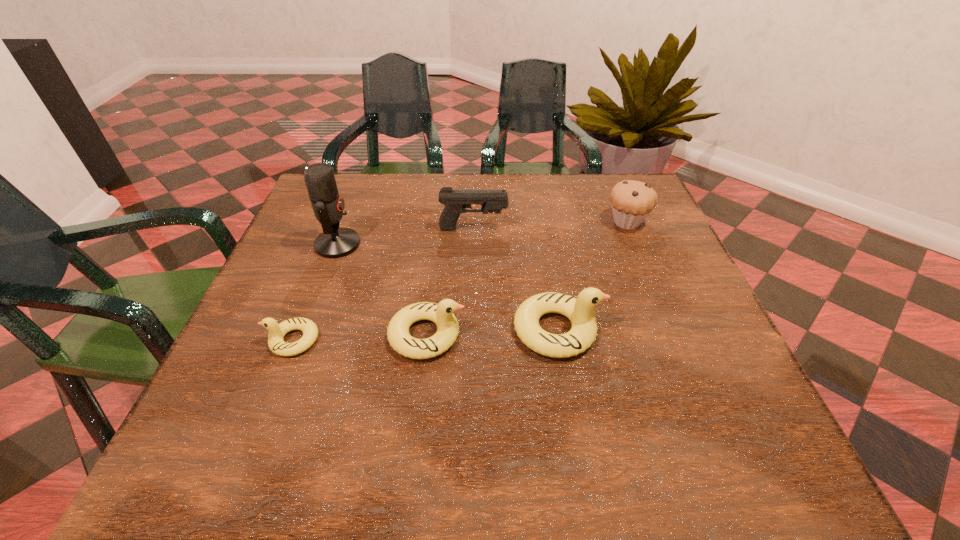
Image resolution: width=960 pixels, height=540 pixels. Find the location of `the leftmost duckling`. the leftmost duckling is located at coordinates (276, 333).

Where is `the shortest object`? The image size is (960, 540). the shortest object is located at coordinates (276, 333).

At what (x,y) coordinates should I click in order to perform the action: click on the second shortest object. Please return your answer as a coordinate pair (x, y). This screenshot has width=960, height=540. Looking at the image, I should click on (442, 314).

Identify the location of the second shortest duckling. This screenshot has height=540, width=960. (442, 314).

Locate an element on the screen. The height and width of the screenshot is (540, 960). the rightmost duckling is located at coordinates (579, 311).

The image size is (960, 540). I want to click on pistol, so click(x=455, y=201).

The height and width of the screenshot is (540, 960). Identify the location of the rightmost object. (631, 201).

I want to click on microphone, so (x=335, y=242).

You are a GUI agent. You are given a task and a screenshot of the screen. Output one action in this format:
    pyautogui.click(x=<x>, y=<y>)
    Task: Click on the vacant space situated on the face of the second duckling from left to right
    
    Given the screenshot: What is the action you would take?
    pyautogui.click(x=599, y=335)

At what (x,y) coordinates should I click in order to perform the action: click on blank space located 0.180m on the face of the rightmost duckling. Please return your answer as a coordinate pair (x, y). Looking at the image, I should click on (693, 329).